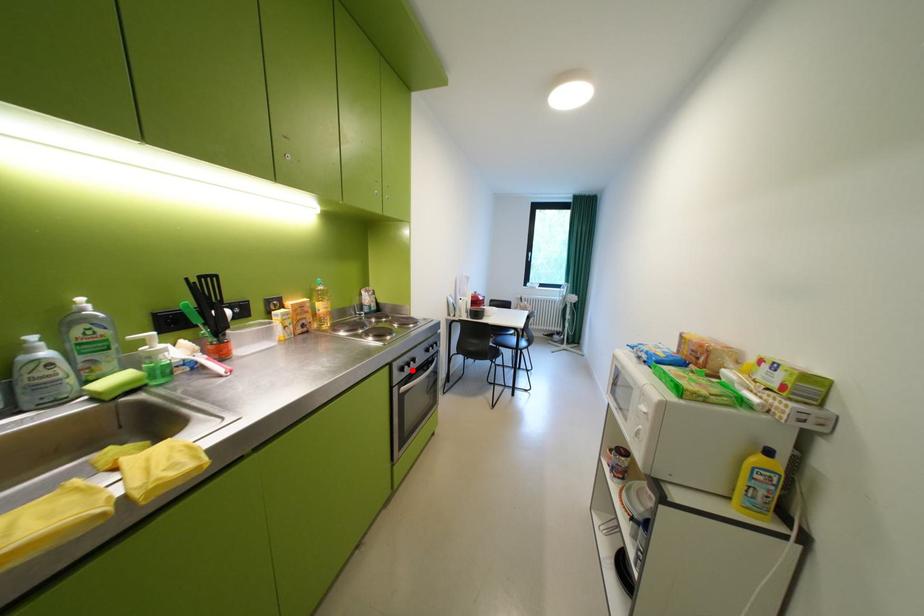
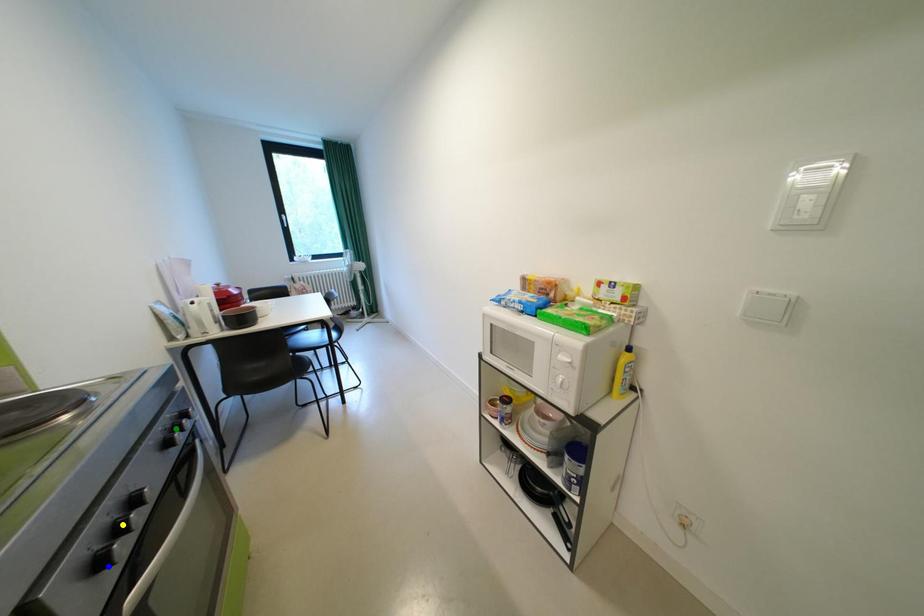
Question: I am providing you with two images of the same scene from different viewpoints. A red point is marked on the first image. You are given multiple points on the second image. In image 2, which mark is for the same physical point as the one in image 1?

Choices:
 (A) green point
 (B) blue point
 (C) yellow point

Answer: (B)